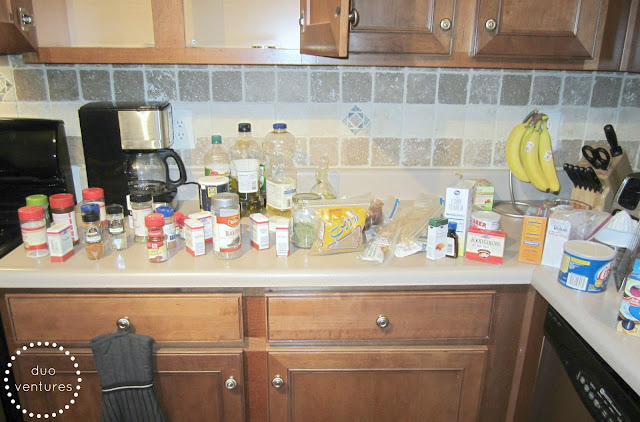
In order to click on countertop in this screenshot , I will do `click(280, 271)`, `click(198, 274)`, `click(43, 269)`, `click(454, 267)`, `click(338, 264)`.